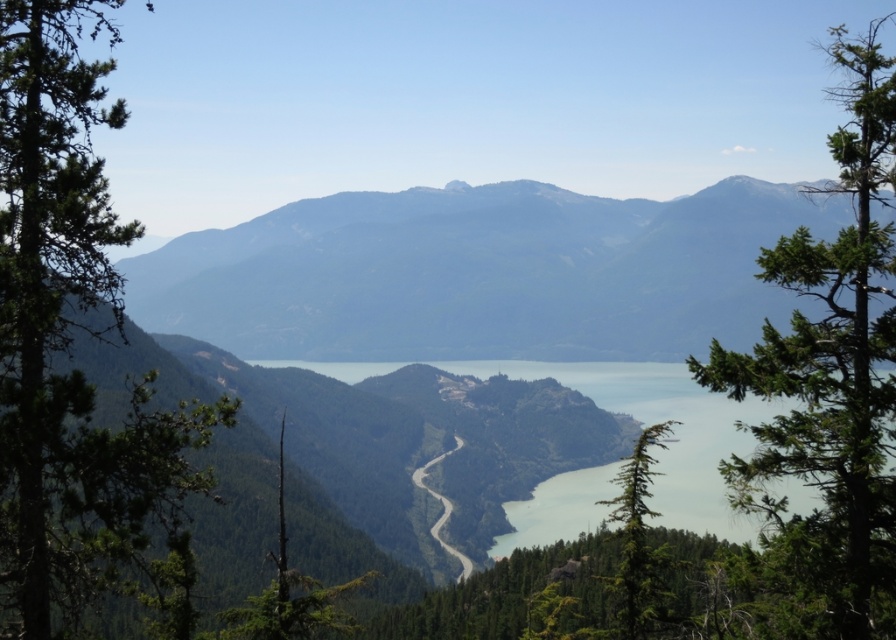
Question: Is gray rocky mountain at center closer to camera compared to green textured tree at left?

Choices:
 (A) no
 (B) yes

Answer: (A)

Question: Which of the following is the farthest from the observer?

Choices:
 (A) gray rocky mountain at center
 (B) green textured tree at lower right
 (C) green textured tree at left

Answer: (B)

Question: Does green leafy tree at right appear under green textured tree at lower right?

Choices:
 (A) no
 (B) yes

Answer: (A)

Question: Estimate the real-world distances between objects in this image. Which object is farther from the green textured tree at left?

Choices:
 (A) green leafy tree at right
 (B) green textured tree at lower right
 (C) gray rocky mountain at center

Answer: (C)

Question: Can you confirm if green textured tree at left is thinner than green leafy tree at right?

Choices:
 (A) yes
 (B) no

Answer: (A)

Question: Among these points, which one is farthest from the camera?

Choices:
 (A) (148, 321)
 (B) (26, 362)
 (C) (650, 426)
 (D) (860, 68)

Answer: (A)